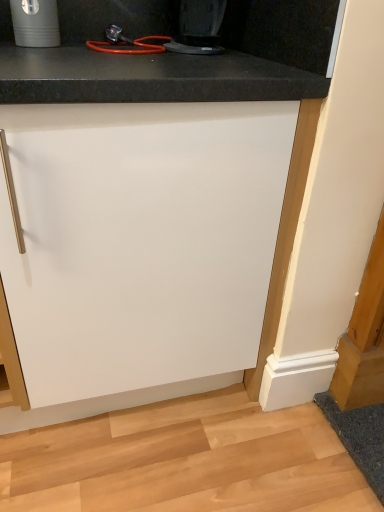
Question: Is white matte cabinet at center positioned with its back to black plastic coffee maker at upper center?

Choices:
 (A) no
 (B) yes

Answer: (A)

Question: Could you tell me if white matte cabinet at center is facing black plastic coffee maker at upper center?

Choices:
 (A) yes
 (B) no

Answer: (B)

Question: Is white matte cabinet at center further to the viewer compared to black plastic coffee maker at upper center?

Choices:
 (A) no
 (B) yes

Answer: (A)

Question: Can we say white matte cabinet at center lies outside black plastic coffee maker at upper center?

Choices:
 (A) yes
 (B) no

Answer: (A)

Question: From the image's perspective, is white matte cabinet at center located beneath black plastic coffee maker at upper center?

Choices:
 (A) no
 (B) yes

Answer: (B)

Question: Is point (190, 309) closer or farther from the camera than point (200, 14)?

Choices:
 (A) closer
 (B) farther

Answer: (A)

Question: Is white matte cabinet at center bigger or smaller than black plastic coffee maker at upper center?

Choices:
 (A) big
 (B) small

Answer: (A)

Question: Considering the relative positions of white matte cabinet at center and black plastic coffee maker at upper center in the image provided, is white matte cabinet at center to the left or to the right of black plastic coffee maker at upper center?

Choices:
 (A) left
 (B) right

Answer: (A)

Question: Is white matte cabinet at center inside the boundaries of black plastic coffee maker at upper center, or outside?

Choices:
 (A) outside
 (B) inside

Answer: (A)

Question: Considering the relative positions of matte black cup at upper left and black plastic coffee maker at upper center in the image provided, is matte black cup at upper left to the left or to the right of black plastic coffee maker at upper center?

Choices:
 (A) right
 (B) left

Answer: (B)

Question: From a real-world perspective, is matte black cup at upper left physically located above or below black plastic coffee maker at upper center?

Choices:
 (A) above
 (B) below

Answer: (A)

Question: Relative to black plastic coffee maker at upper center, is matte black cup at upper left in front or behind?

Choices:
 (A) behind
 (B) front

Answer: (A)

Question: From the image's perspective, is matte black cup at upper left above or below black plastic coffee maker at upper center?

Choices:
 (A) below
 (B) above

Answer: (B)

Question: In terms of width, does black plastic coffee maker at upper center look wider or thinner when compared to white matte cabinet at center?

Choices:
 (A) thin
 (B) wide

Answer: (A)

Question: Is point (221, 4) closer or farther from the camera than point (54, 115)?

Choices:
 (A) closer
 (B) farther

Answer: (B)